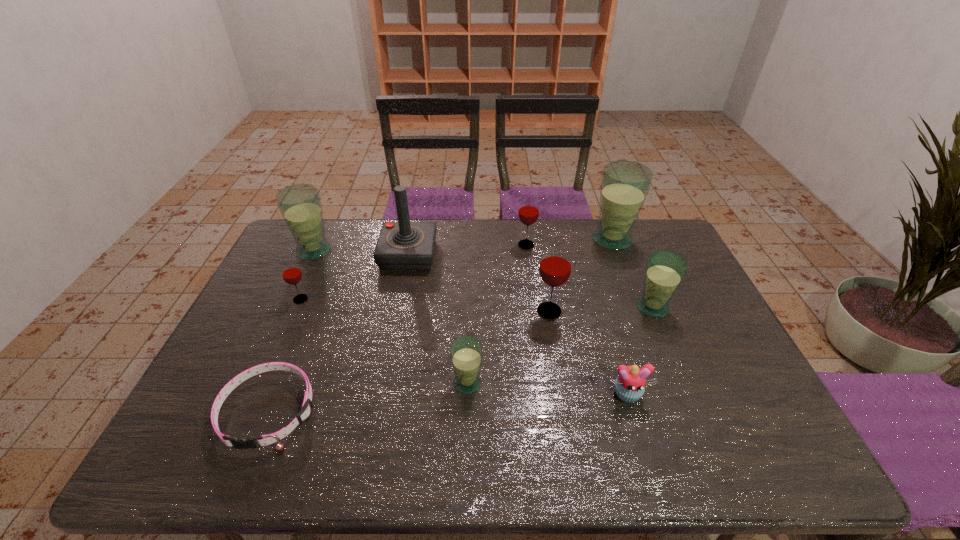
Find the location of a particular element. vacant space located 0.290m on the back of the fifth object from left to right is located at coordinates (469, 294).

Find the location of a particular element. free space located 0.070m on the face of the ninth tallest object is located at coordinates (638, 433).

Identify the location of joystick that is at the far edge. (403, 245).

Image resolution: width=960 pixels, height=540 pixels. I want to click on object located at the near edge, so click(x=263, y=440).

I want to click on dog collar present at the left edge, so click(x=263, y=440).

Locate an element on the screen. Image resolution: width=960 pixels, height=540 pixels. object positioned at the far left corner is located at coordinates (300, 205).

Where is `object at the near left corner`? This screenshot has width=960, height=540. object at the near left corner is located at coordinates (263, 440).

Where is `object situated at the far right corner`? object situated at the far right corner is located at coordinates (625, 185).

Where is `blank space at the far edge`? The width and height of the screenshot is (960, 540). blank space at the far edge is located at coordinates (624, 253).

The height and width of the screenshot is (540, 960). What are the coordinates of `vacant space at the near edge` in the screenshot? It's located at (497, 468).